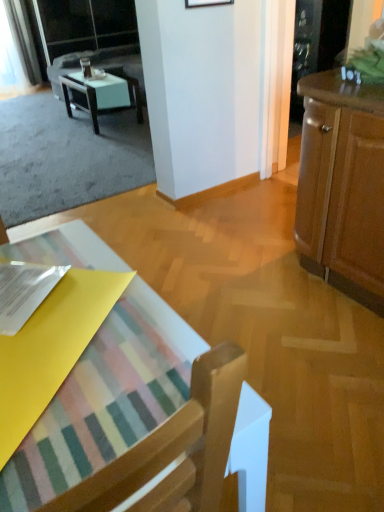
Question: Visually, is wooden chair at lower left positioned to the left or to the right of white glossy table at upper left?

Choices:
 (A) left
 (B) right

Answer: (B)

Question: Is wooden chair at lower left in front of or behind white glossy table at upper left in the image?

Choices:
 (A) front
 (B) behind

Answer: (A)

Question: Which of these objects is positioned farthest from the wooden cabinet at right?

Choices:
 (A) white glossy table at upper left
 (B) matte black couch at upper left
 (C) transparent glass cabinet at upper right, acting as the second screen door starting from the top
 (D) transparent glass screen door at upper left, which appears as the first screen door when viewed from the left
 (E) wooden picture frame at upper center

Answer: (D)

Question: Which object is the farthest from the wooden chair at lower left?

Choices:
 (A) transparent glass cabinet at upper right, acting as the 2th screen door starting from the left
 (B) matte black couch at upper left
 (C) white glossy table at upper left
 (D) transparent glass screen door at upper left, the 2th screen door positioned from the front
 (E) wooden picture frame at upper center

Answer: (D)